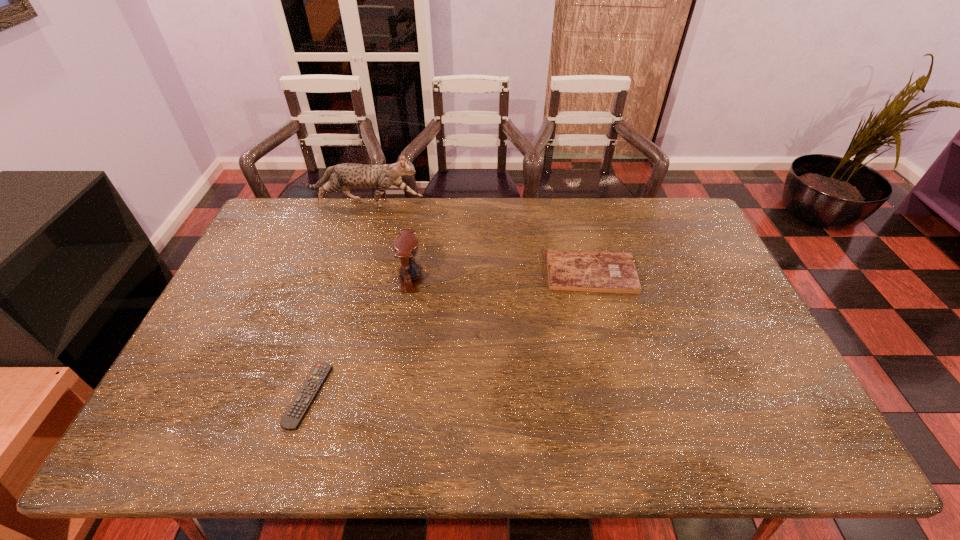
You are a GUI agent. You are given a task and a screenshot of the screen. Output one action in this format:
    pyautogui.click(x=<x>, y=<y>)
    Task: Click on the vacant area between the hourglass and the tallest object
    The image size is (960, 540).
    Given the screenshot: What is the action you would take?
    (x=388, y=241)

Locate an element on the screen. Image resolution: width=960 pixels, height=540 pixels. empty space that is in between the nearest object and the rightmost object is located at coordinates (449, 334).

The width and height of the screenshot is (960, 540). Identify the location of empty space between the farthest object and the third shortest object. (388, 241).

The image size is (960, 540). Identify the location of vacant space that is in between the hourglass and the remote control. (360, 338).

Where is `empty location between the second shortest object and the farthest object`? The image size is (960, 540). empty location between the second shortest object and the farthest object is located at coordinates (478, 239).

Locate an element on the screen. The width and height of the screenshot is (960, 540). free space between the remote control and the third shortest object is located at coordinates (360, 338).

I want to click on vacant area between the hourglass and the cat, so click(x=388, y=241).

This screenshot has width=960, height=540. What are the coordinates of `vacant region between the hourglass and the rightmost object` in the screenshot? It's located at (501, 276).

The image size is (960, 540). Find the location of `free area in between the cat and the rightmost object`. free area in between the cat and the rightmost object is located at coordinates (478, 239).

Identify the location of free space between the third shortest object and the Bible. The image size is (960, 540). (501, 276).